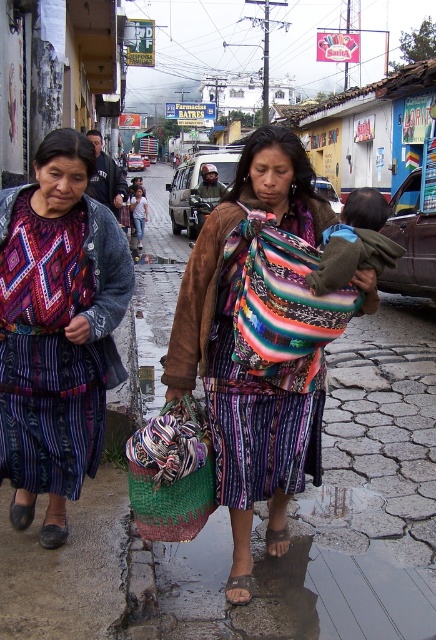
Question: Which object appears farthest from the camera in this image?

Choices:
 (A) matte black jacket at left
 (B) braided straw bag at lower center

Answer: (A)

Question: Estimate the real-world distances between objects in this image. Which object is farther from the multicolored woven shawl at center?

Choices:
 (A) braided straw bag at lower center
 (B) matte black jacket at left

Answer: (B)

Question: Considering the relative positions of matte black jacket at left and braided straw bag at lower center in the image provided, where is matte black jacket at left located with respect to braided straw bag at lower center?

Choices:
 (A) above
 (B) below

Answer: (A)

Question: Which point is farther to the camera?

Choices:
 (A) (288, 260)
 (B) (167, 474)
 (C) (23, 426)

Answer: (C)

Question: Observing the image, what is the correct spatial positioning of multicolored woven shawl at center in reference to matte black jacket at left?

Choices:
 (A) right
 (B) left

Answer: (A)

Question: Is matte black jacket at left to the right of braided straw bag at lower center from the viewer's perspective?

Choices:
 (A) yes
 (B) no

Answer: (B)